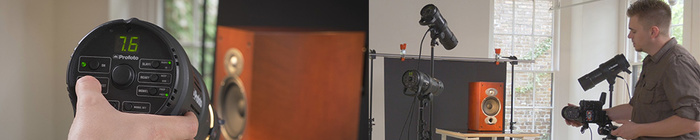
I want to click on window, so click(x=535, y=30).